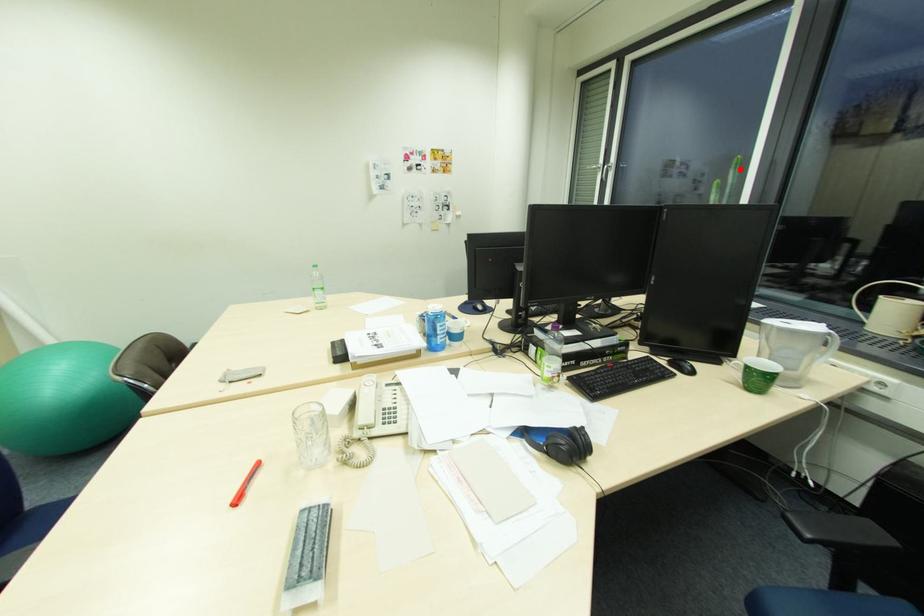
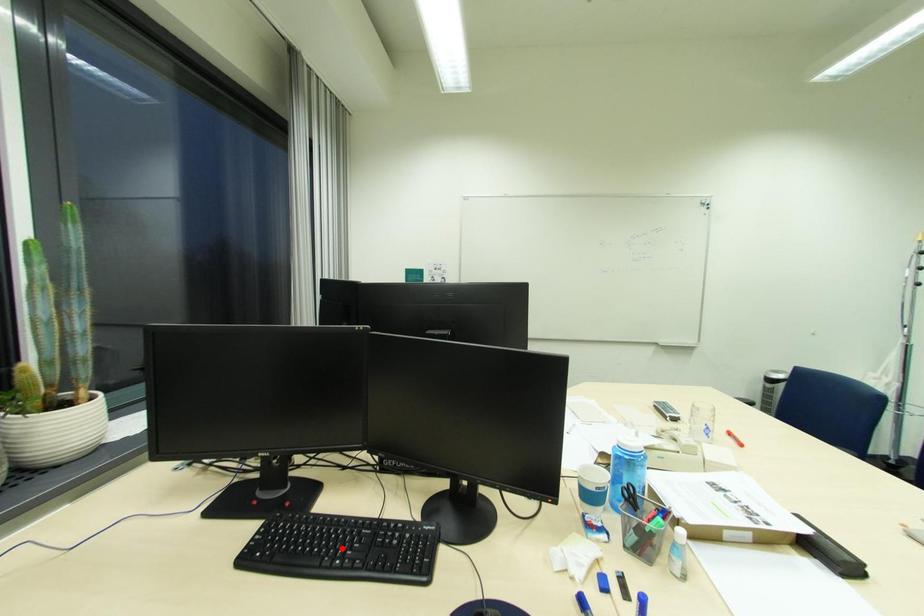
I am providing you with two images of the same scene from different viewpoints. A red point is marked on the first image and another point is marked on the second image. Does the point marked in image1 correspond to the same location as the one in image2?

No